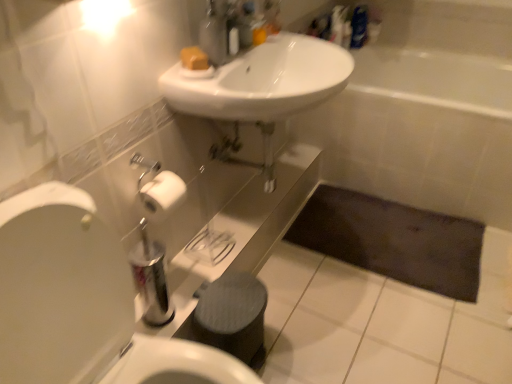
Question: Should I look upward or downward to see dark fabric bath mat at lower center?

Choices:
 (A) down
 (B) up

Answer: (A)

Question: Can white ceramic bathtub at center be found inside white glossy sink at upper center?

Choices:
 (A) yes
 (B) no

Answer: (B)

Question: Is white glossy sink at upper center positioned with its back to white ceramic bathtub at center?

Choices:
 (A) no
 (B) yes

Answer: (A)

Question: Does white glossy sink at upper center have a greater height compared to white ceramic bathtub at center?

Choices:
 (A) no
 (B) yes

Answer: (A)

Question: From a real-world perspective, does white glossy sink at upper center stand above white ceramic bathtub at center?

Choices:
 (A) no
 (B) yes

Answer: (B)

Question: Can you confirm if white glossy sink at upper center is positioned to the left of white ceramic bathtub at center?

Choices:
 (A) no
 (B) yes

Answer: (B)

Question: Considering the relative positions of white glossy sink at upper center and white ceramic bathtub at center in the image provided, is white glossy sink at upper center behind white ceramic bathtub at center?

Choices:
 (A) yes
 (B) no

Answer: (B)

Question: Can you confirm if white glossy toilet at left is shorter than dark fabric bath mat at lower center?

Choices:
 (A) no
 (B) yes

Answer: (A)

Question: Does white glossy toilet at left contain dark fabric bath mat at lower center?

Choices:
 (A) no
 (B) yes

Answer: (A)

Question: Does white glossy toilet at left have a lesser width compared to dark fabric bath mat at lower center?

Choices:
 (A) yes
 (B) no

Answer: (B)

Question: Can you confirm if white glossy toilet at left is positioned to the left of dark fabric bath mat at lower center?

Choices:
 (A) yes
 (B) no

Answer: (A)

Question: From the image's perspective, is white glossy toilet at left below dark fabric bath mat at lower center?

Choices:
 (A) no
 (B) yes

Answer: (B)

Question: Is white glossy toilet at left further to the viewer compared to dark fabric bath mat at lower center?

Choices:
 (A) no
 (B) yes

Answer: (A)

Question: From a real-world perspective, is white glossy toilet at left located higher than matte plastic soap dispenser at upper center?

Choices:
 (A) no
 (B) yes

Answer: (A)